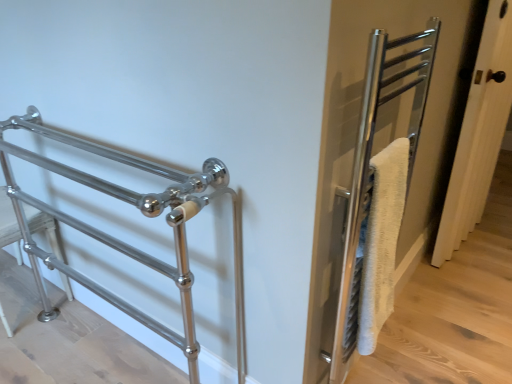
Locate an element on the screen. The width and height of the screenshot is (512, 384). polished metal towel rack at left is located at coordinates (125, 243).

In order to face polished metal towel rack at left, should I rotate leftwards or rightwards?

You should rotate left by 19.713 degrees.

This screenshot has width=512, height=384. What do you see at coordinates (125, 243) in the screenshot?
I see `polished metal towel rack at left` at bounding box center [125, 243].

You are a GUI agent. You are given a task and a screenshot of the screen. Output one action in this format:
    pyautogui.click(x=<x>, y=<y>)
    Task: Click on the white wood door at right
    
    Given the screenshot: What is the action you would take?
    pyautogui.click(x=479, y=132)

This screenshot has width=512, height=384. Describe the element at coordinates (479, 132) in the screenshot. I see `white wood door at right` at that location.

Identify the location of polished metal towel rack at left. (125, 243).

Consider the image. Between white wood door at right and polished metal towel rack at left, which one appears on the right side from the viewer's perspective?

white wood door at right.

In the scene shown: Is the depth of white wood door at right less than that of polished metal towel rack at left?

No, the depth of white wood door at right is greater than that of polished metal towel rack at left.

Which is nearer, (453, 249) or (99, 189)?

Point (453, 249) is positioned farther from the camera compared to point (99, 189).

From the image's perspective, is white wood door at right below polished metal towel rack at left?

No.

From a real-world perspective, which object rests below the other?

In real-world perspective, polished metal towel rack at left is lower.

Is white wood door at right wider than polished metal towel rack at left?

In fact, white wood door at right might be narrower than polished metal towel rack at left.

Consider the image. Between white wood door at right and polished metal towel rack at left, which one has more height?

white wood door at right.

Looking at this image, considering the sizes of white wood door at right and polished metal towel rack at left in the image, is white wood door at right bigger or smaller than polished metal towel rack at left?

In the image, white wood door at right appears to be smaller than polished metal towel rack at left.

Is white wood door at right not inside polished metal towel rack at left?

Indeed, white wood door at right is completely outside polished metal towel rack at left.

Is white wood door at right in contact with polished metal towel rack at left?

No, white wood door at right is not beside polished metal towel rack at left.

Is white wood door at right facing towards polished metal towel rack at left?

No, white wood door at right is not facing towards polished metal towel rack at left.

Where is `door that appears behind the polished metal towel rack at left`? door that appears behind the polished metal towel rack at left is located at coordinates (479, 132).

Would you say polished metal towel rack at left is to the left or to the right of white wood door at right in the picture?

polished metal towel rack at left is to the left of white wood door at right.

Which object is more forward, polished metal towel rack at left or white wood door at right?

polished metal towel rack at left is in front.

Between point (176, 342) and point (485, 58), which one is positioned in front?

Positioned in front is point (176, 342).

From the image's perspective, between polished metal towel rack at left and white wood door at right, which one is located above?

white wood door at right, from the image's perspective.

From the picture: From a real-world perspective, between polished metal towel rack at left and white wood door at right, who is vertically higher?

white wood door at right.

In terms of width, does polished metal towel rack at left look wider or thinner when compared to white wood door at right?

polished metal towel rack at left is wider than white wood door at right.

Based on the photo, is polished metal towel rack at left taller than white wood door at right?

No, polished metal towel rack at left is not taller than white wood door at right.

Considering the relative sizes of polished metal towel rack at left and white wood door at right in the image provided, is polished metal towel rack at left smaller than white wood door at right?

Incorrect, polished metal towel rack at left is not smaller in size than white wood door at right.

Is polished metal towel rack at left situated inside white wood door at right or outside?

polished metal towel rack at left lies outside white wood door at right.

Consider the image. Is polished metal towel rack at left not close to white wood door at right?

That's right, there is a large distance between polished metal towel rack at left and white wood door at right.

Is white wood door at right at the back of polished metal towel rack at left?

Yes, white wood door at right is at the back of polished metal towel rack at left.

How many degrees apart are the facing directions of polished metal towel rack at left and white wood door at right?

86 degrees separate the facing orientations of polished metal towel rack at left and white wood door at right.

Find the location of a particular element. This screenshot has height=384, width=512. steel in front of the white wood door at right is located at coordinates (125, 243).

Identify the location of steel lying in front of the white wood door at right. This screenshot has width=512, height=384. (125, 243).

This screenshot has width=512, height=384. There is a polished metal towel rack at left. What are the coordinates of `door above it (from a real-world perspective)` in the screenshot? It's located at (479, 132).